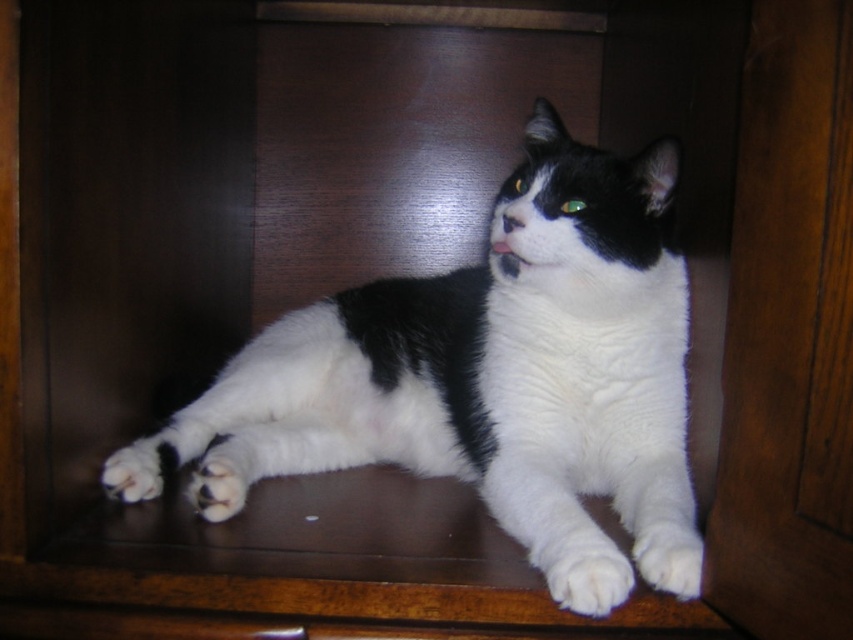
Question: Considering the real-world distances, which object is closest to the white fur at lower right?

Choices:
 (A) black and white fur cat at center
 (B) white fur at lower left

Answer: (A)

Question: Which object is the farthest from the white fur at lower center?

Choices:
 (A) white fur at lower left
 (B) black and white fur cat at center
 (C) white fluffy paw at lower center

Answer: (C)

Question: Can you confirm if black and white fur cat at center is smaller than white fur at lower left?

Choices:
 (A) no
 (B) yes

Answer: (A)

Question: Among these points, which one is farthest from the camera?

Choices:
 (A) (701, 540)
 (B) (196, 500)
 (C) (643, 513)

Answer: (B)

Question: Does white fluffy paw at lower center have a smaller size compared to white fur at lower right?

Choices:
 (A) yes
 (B) no

Answer: (A)

Question: Can you confirm if black and white fur cat at center is thinner than white fur at lower right?

Choices:
 (A) yes
 (B) no

Answer: (B)